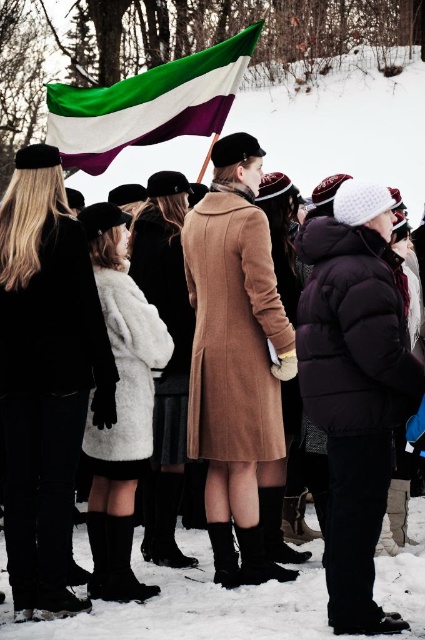
You are a photographer standing at the edge of the snowy gathering. You need to take a photo that includes both the white fur coat at center and the fuzzy white coat at center. Given that your camera has a maximum focus range of 4 meters, will you be able to capture both coats in focus without moving closer?

The white fur coat at center is 4.29 meters from the fuzzy white coat at center. Since the distance between them exceeds the camera maximum focus range of 4 meters, you won not be able to capture both coats in focus without moving closer.